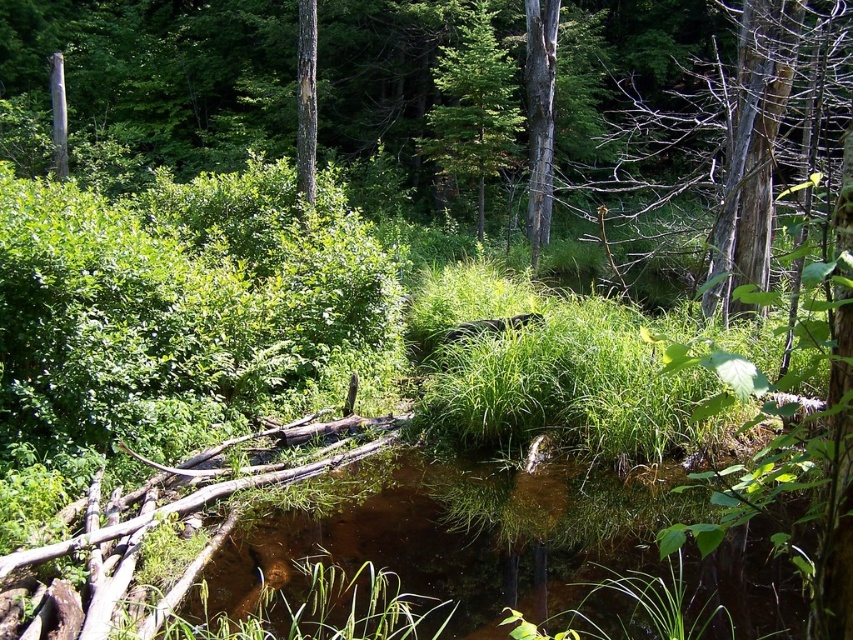
Does brown murky water at center appear on the right side of gray bark tree at center?

In fact, brown murky water at center is to the left of gray bark tree at center.

Does brown murky water at center have a lesser width compared to gray bark tree at center?

In fact, brown murky water at center might be wider than gray bark tree at center.

Is point (473, 614) in front of point (535, 195)?

That is True.

Identify the location of brown murky water at center. (448, 538).

Is green matte tree at upper center thinner than gray bark tree at center?

No, green matte tree at upper center is not thinner than gray bark tree at center.

Where is `green matte tree at upper center`? green matte tree at upper center is located at coordinates (473, 106).

At what (x,y) coordinates should I click in order to perform the action: click on green matte tree at upper center. Please return your answer as a coordinate pair (x, y). The image size is (853, 640). Looking at the image, I should click on (473, 106).

Can you confirm if gray bark tree at center is positioned to the left of smooth brown tree trunk at center?

In fact, gray bark tree at center is to the right of smooth brown tree trunk at center.

Based on the photo, which is more to the left, gray bark tree at center or smooth brown tree trunk at center?

smooth brown tree trunk at center

Measure the distance between gray bark tree at center and camera.

They are 11.03 meters apart.

Locate an element on the screen. The width and height of the screenshot is (853, 640). gray bark tree at center is located at coordinates (538, 115).